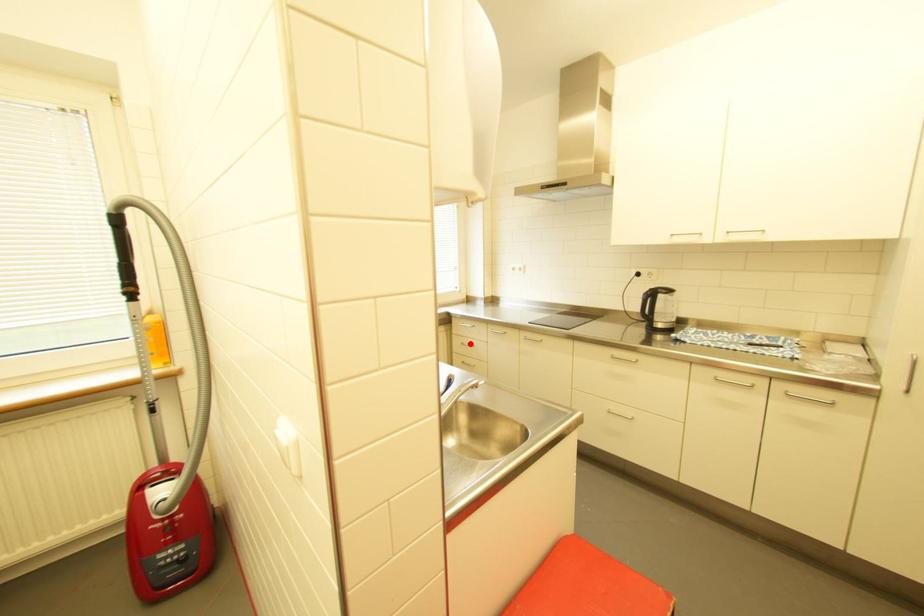
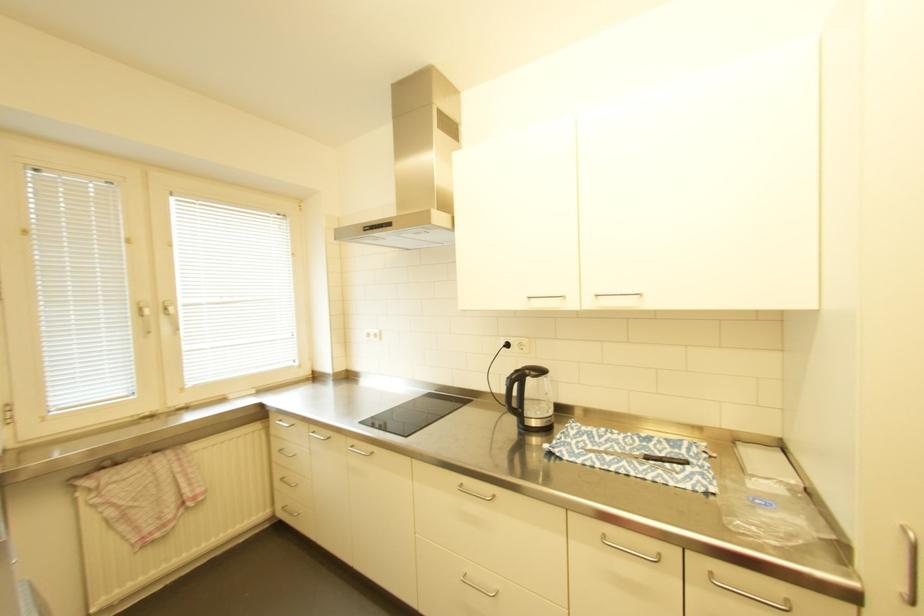
In the second image, find the point that corresponds to the highlighted location in the first image.

(287, 451)